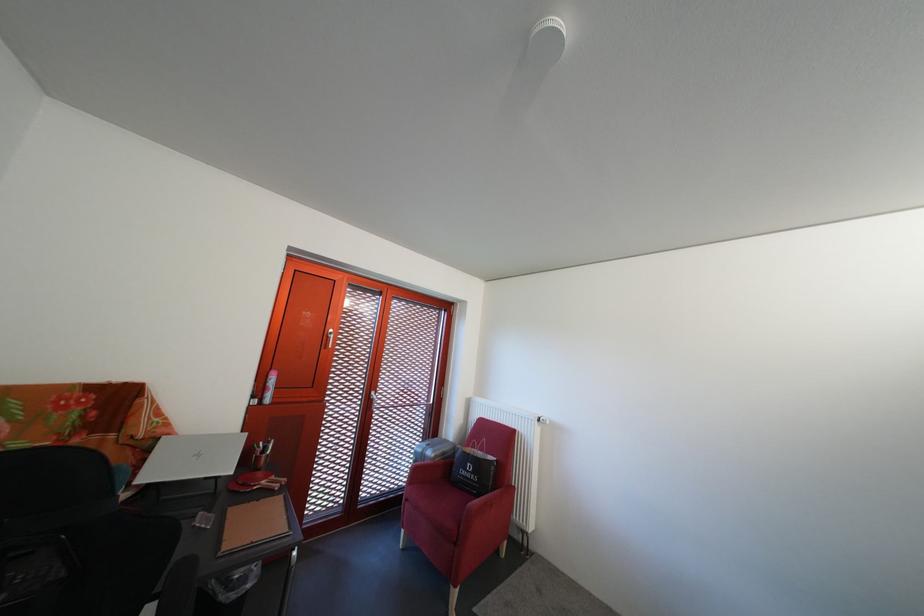
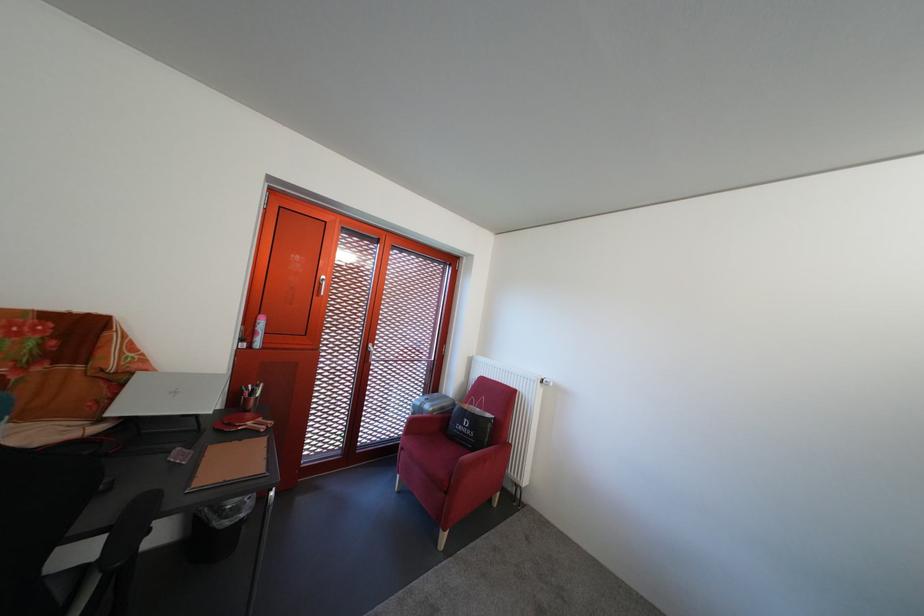
Locate, in the second image, the point that corresponds to (210,462) in the first image.

(187, 399)